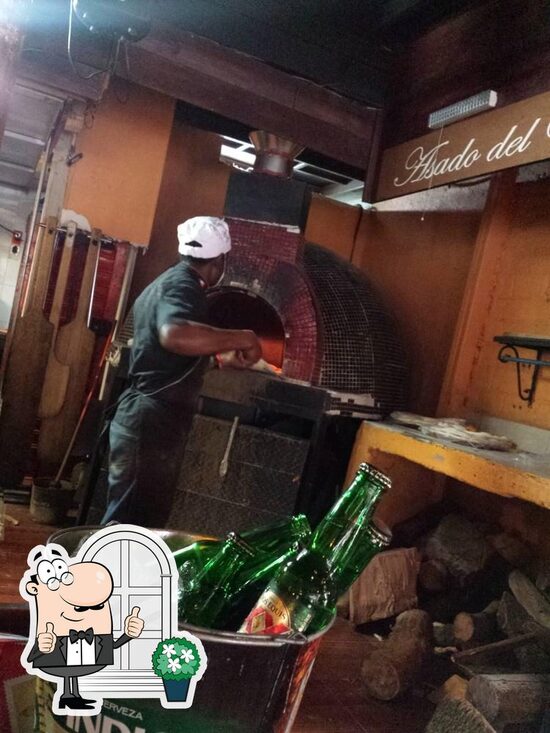
Find the location of `1 oven`. 1 oven is located at coordinates (279, 303).